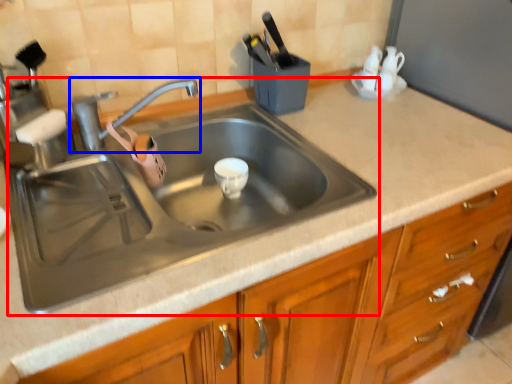
Question: Which point is further to the camera, sink (highlighted by a red box) or tap (highlighted by a blue box)?

Choices:
 (A) sink
 (B) tap

Answer: (B)